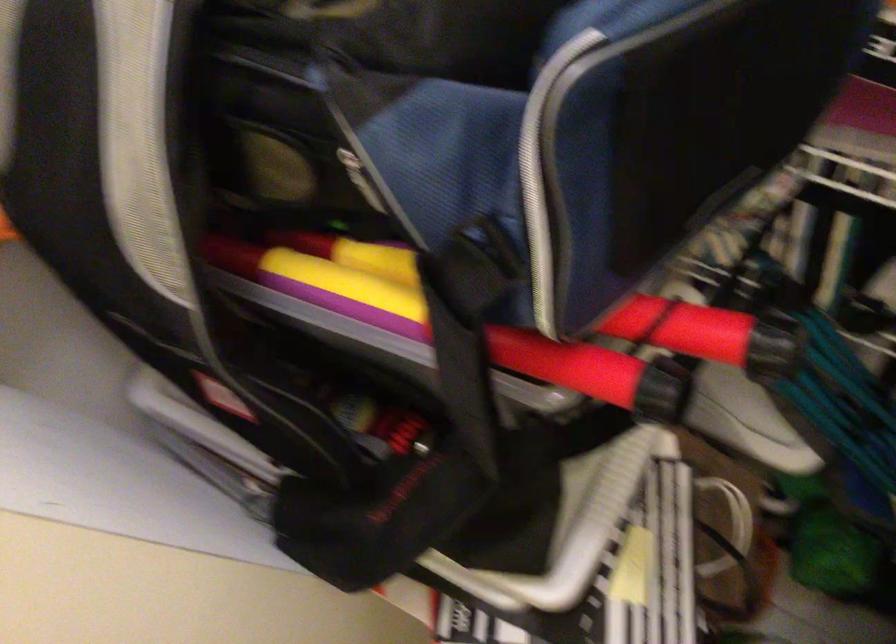
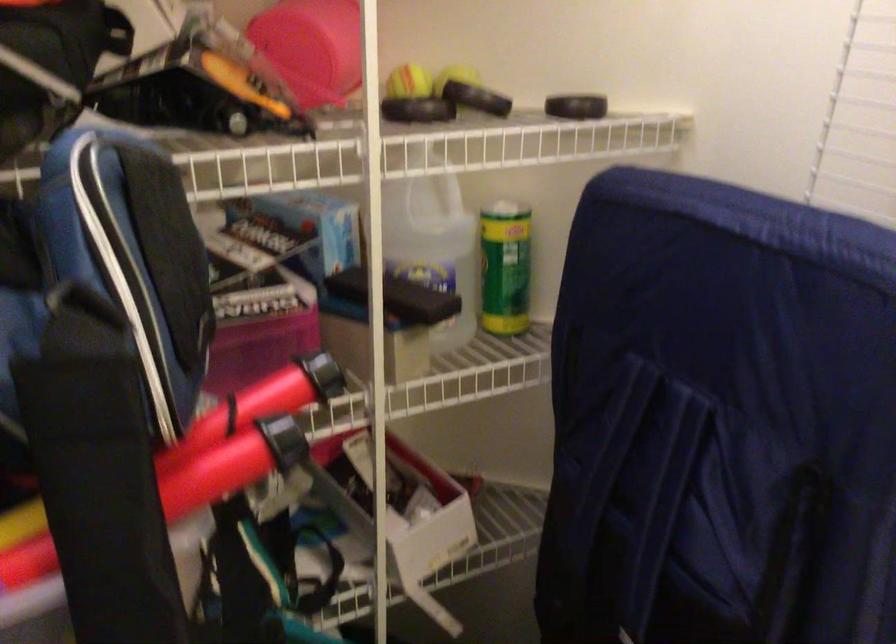
The images are taken continuously from a first-person perspective. In which direction is your viewpoint rotating?

The camera's rotation is toward right-up.